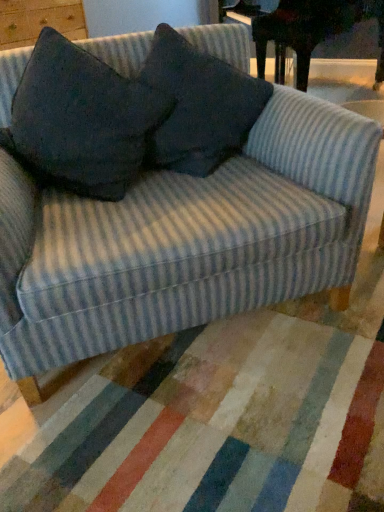
Question: Can you confirm if dark fabric pillow at center, which is the 1th throw pillow from right to left, is smaller than dark gray fabric pillow at upper center, which is counted as the 1th throw pillow, starting from the left?

Choices:
 (A) no
 (B) yes

Answer: (B)

Question: Is dark fabric pillow at center, which is the 1th throw pillow from right to left, located outside dark gray fabric pillow at upper center, which is counted as the 1th throw pillow, starting from the left?

Choices:
 (A) yes
 (B) no

Answer: (A)

Question: From the image's perspective, is dark fabric pillow at center, which is the second throw pillow from left to right, on top of dark gray fabric pillow at upper center, which appears as the 2th throw pillow when viewed from the right?

Choices:
 (A) no
 (B) yes

Answer: (B)

Question: Does dark fabric pillow at center, which is the 1th throw pillow from right to left, have a larger size compared to dark gray fabric pillow at upper center, which appears as the 2th throw pillow when viewed from the right?

Choices:
 (A) yes
 (B) no

Answer: (B)

Question: Is there a large distance between dark fabric pillow at center, which is the second throw pillow from left to right, and dark gray fabric pillow at upper center, which appears as the 2th throw pillow when viewed from the right?

Choices:
 (A) no
 (B) yes

Answer: (A)

Question: Based on their sizes in the image, would you say dark wood piano at upper right is bigger or smaller than dark fabric pillow at center, which is the 1th throw pillow from right to left?

Choices:
 (A) small
 (B) big

Answer: (B)

Question: In the image, is dark wood piano at upper right on the left side or the right side of dark fabric pillow at center, which is the second throw pillow from left to right?

Choices:
 (A) left
 (B) right

Answer: (B)

Question: From the image's perspective, is dark wood piano at upper right positioned above or below dark fabric pillow at center, which is the 1th throw pillow from right to left?

Choices:
 (A) below
 (B) above

Answer: (B)

Question: From a real-world perspective, is dark wood piano at upper right positioned above or below dark fabric pillow at center, which is the 1th throw pillow from right to left?

Choices:
 (A) above
 (B) below

Answer: (B)

Question: From the image's perspective, is dark wood piano at upper right located above or below dark gray fabric pillow at upper center, which is counted as the 1th throw pillow, starting from the left?

Choices:
 (A) below
 (B) above

Answer: (B)

Question: From a real-world perspective, relative to dark gray fabric pillow at upper center, which is counted as the 1th throw pillow, starting from the left, is dark wood piano at upper right vertically above or below?

Choices:
 (A) below
 (B) above

Answer: (A)

Question: In the image, is dark wood piano at upper right positioned in front of or behind dark gray fabric pillow at upper center, which appears as the 2th throw pillow when viewed from the right?

Choices:
 (A) front
 (B) behind

Answer: (B)

Question: Visually, is dark wood piano at upper right positioned to the left or to the right of dark gray fabric pillow at upper center, which appears as the 2th throw pillow when viewed from the right?

Choices:
 (A) right
 (B) left

Answer: (A)

Question: From their relative heights in the image, would you say dark fabric pillow at center, which is the second throw pillow from left to right, is taller or shorter than dark gray fabric pillow at upper center, which is counted as the 1th throw pillow, starting from the left?

Choices:
 (A) tall
 (B) short

Answer: (B)

Question: Looking at the image, does dark fabric pillow at center, which is the 1th throw pillow from right to left, seem bigger or smaller compared to dark gray fabric pillow at upper center, which appears as the 2th throw pillow when viewed from the right?

Choices:
 (A) big
 (B) small

Answer: (B)